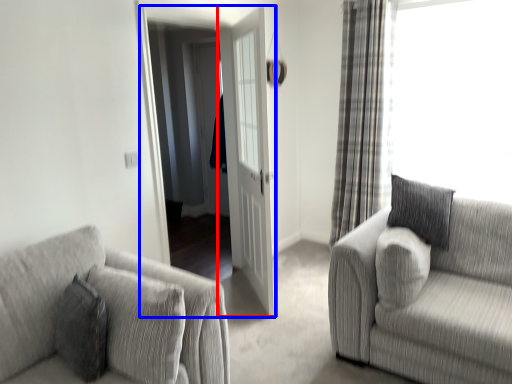
Question: Which point is closer to the camera, door (highlighted by a red box) or screen door (highlighted by a blue box)?

Choices:
 (A) door
 (B) screen door

Answer: (A)